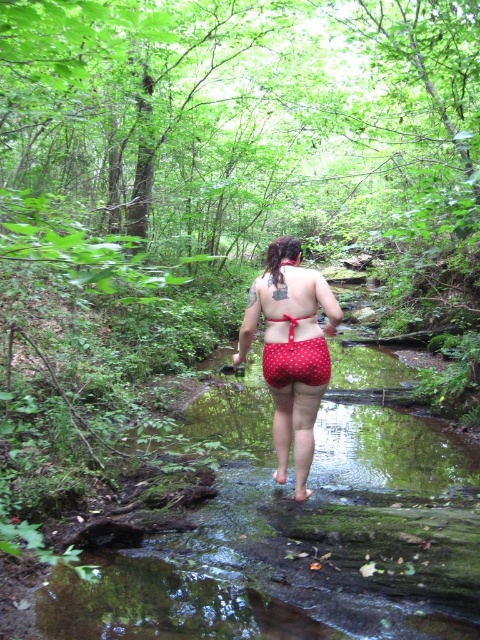
Question: Which point is farther to the camera?

Choices:
 (A) red dotted fabric at center
 (B) red polka dot shorts at center
 (C) red polka dot bikini top at center

Answer: (C)

Question: From the image, what is the correct spatial relationship of red polka dot shorts at center in relation to red polka dot bikini top at center?

Choices:
 (A) left
 (B) right

Answer: (A)

Question: Can you confirm if red dotted fabric at center is thinner than red polka dot bikini top at center?

Choices:
 (A) no
 (B) yes

Answer: (A)

Question: Which point appears closest to the camera in this image?

Choices:
 (A) (265, 353)
 (B) (304, 378)

Answer: (B)

Question: Which object appears closest to the camera in this image?

Choices:
 (A) red dotted fabric at center
 (B) red polka dot shorts at center
 (C) red polka dot bikini top at center

Answer: (B)

Question: Is red polka dot shorts at center to the left of red polka dot bikini top at center from the viewer's perspective?

Choices:
 (A) no
 (B) yes

Answer: (B)